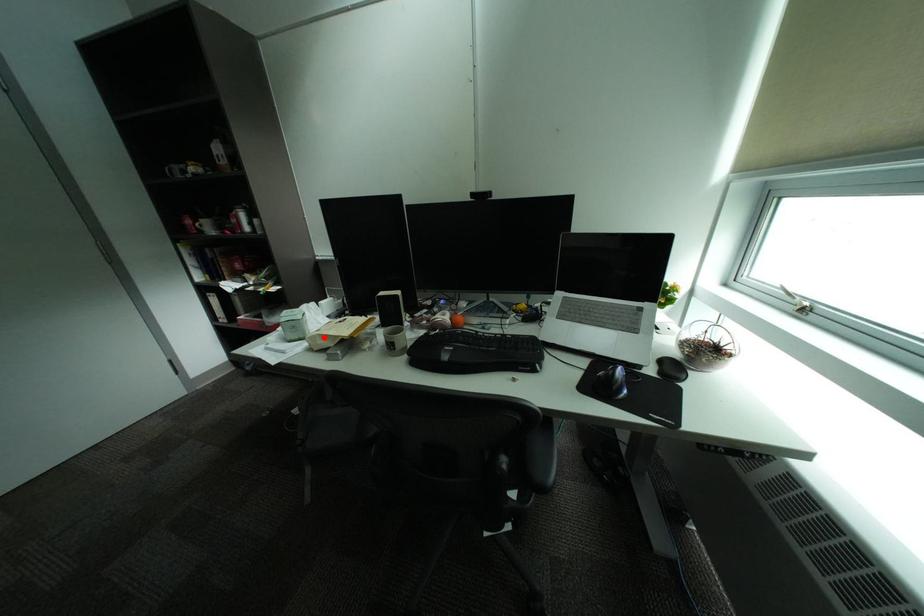
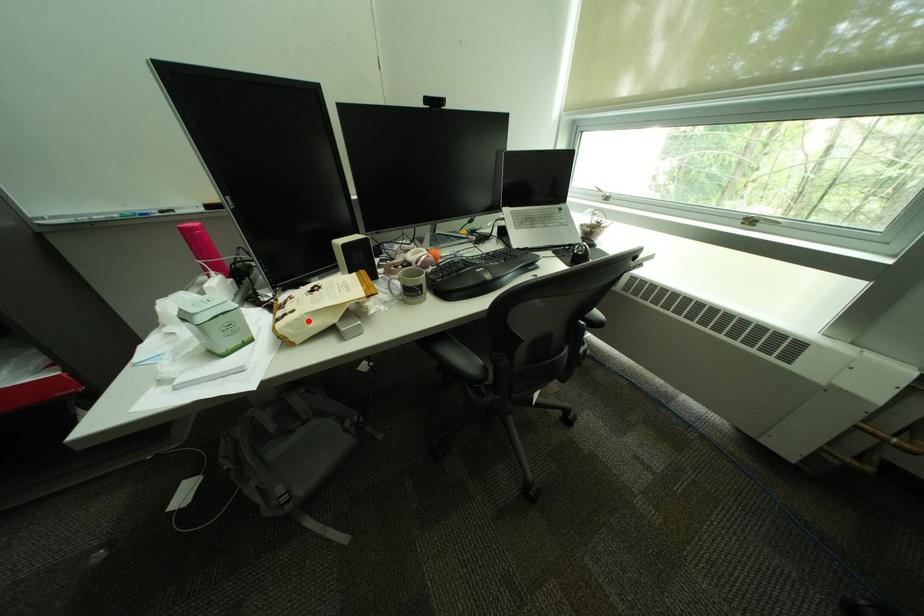
I am providing you with two images of the same scene from different viewpoints. A red point is marked on the first image and another point is marked on the second image. Is the marked point in image1 the same physical position as the marked point in image2?

Yes